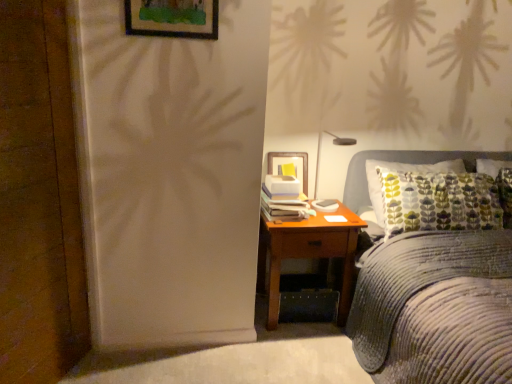
Question: Is wooden picture frame at upper center further to the viewer compared to corduroy fabric bed at right?

Choices:
 (A) yes
 (B) no

Answer: (A)

Question: Is wooden picture frame at upper center to the right of corduroy fabric bed at right from the viewer's perspective?

Choices:
 (A) yes
 (B) no

Answer: (B)

Question: From the image's perspective, is wooden picture frame at upper center under corduroy fabric bed at right?

Choices:
 (A) no
 (B) yes

Answer: (A)

Question: Considering the relative sizes of wooden picture frame at upper center and corduroy fabric bed at right in the image provided, is wooden picture frame at upper center shorter than corduroy fabric bed at right?

Choices:
 (A) no
 (B) yes

Answer: (B)

Question: Is wooden picture frame at upper center completely or partially outside of corduroy fabric bed at right?

Choices:
 (A) yes
 (B) no

Answer: (A)

Question: From the image's perspective, is wooden picture frame at upper center located above or below corduroy fabric bed at right?

Choices:
 (A) below
 (B) above

Answer: (B)

Question: Considering the positions of wooden picture frame at upper center and corduroy fabric bed at right in the image, is wooden picture frame at upper center bigger or smaller than corduroy fabric bed at right?

Choices:
 (A) small
 (B) big

Answer: (A)

Question: Considering the positions of wooden picture frame at upper center and corduroy fabric bed at right in the image, is wooden picture frame at upper center wider or thinner than corduroy fabric bed at right?

Choices:
 (A) wide
 (B) thin

Answer: (B)

Question: Is wooden picture frame at upper center in front of or behind corduroy fabric bed at right in the image?

Choices:
 (A) front
 (B) behind

Answer: (B)

Question: In terms of height, does wooden picture frame at upper center look taller or shorter compared to matte black lamp at upper right?

Choices:
 (A) short
 (B) tall

Answer: (A)

Question: Which is correct: wooden picture frame at upper center is inside matte black lamp at upper right, or outside of it?

Choices:
 (A) inside
 (B) outside

Answer: (B)

Question: Does point (182, 29) appear closer or farther from the camera than point (344, 137)?

Choices:
 (A) farther
 (B) closer

Answer: (B)

Question: In the image, is wooden picture frame at upper center positioned in front of or behind matte black lamp at upper right?

Choices:
 (A) front
 (B) behind

Answer: (A)

Question: In the image, is corduroy fabric bed at right positioned in front of or behind matte black lamp at upper right?

Choices:
 (A) front
 (B) behind

Answer: (A)

Question: In terms of width, does corduroy fabric bed at right look wider or thinner when compared to matte black lamp at upper right?

Choices:
 (A) thin
 (B) wide

Answer: (B)